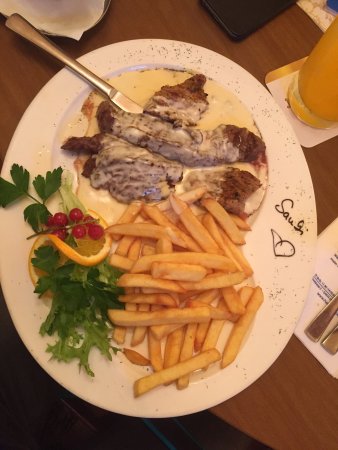
This screenshot has width=338, height=450. What are the coordinates of `bottom of utensils` in the screenshot? It's located at tap(310, 333), tap(332, 345).